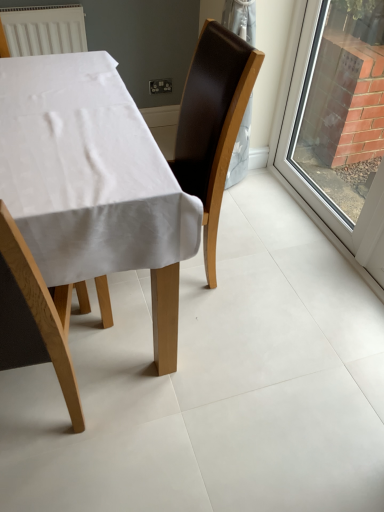
At what (x,y) coordinates should I click in order to perform the action: click on vacant space that's between brown leather chair at center, the 2th chair from the front, and clear glass window at right. Please return your answer as a coordinate pair (x, y). Looking at the image, I should click on (272, 236).